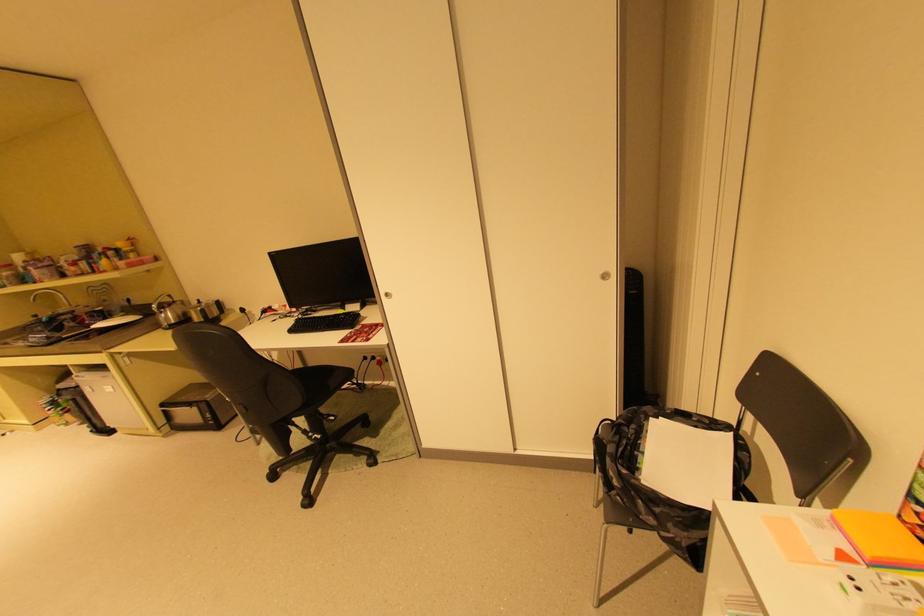
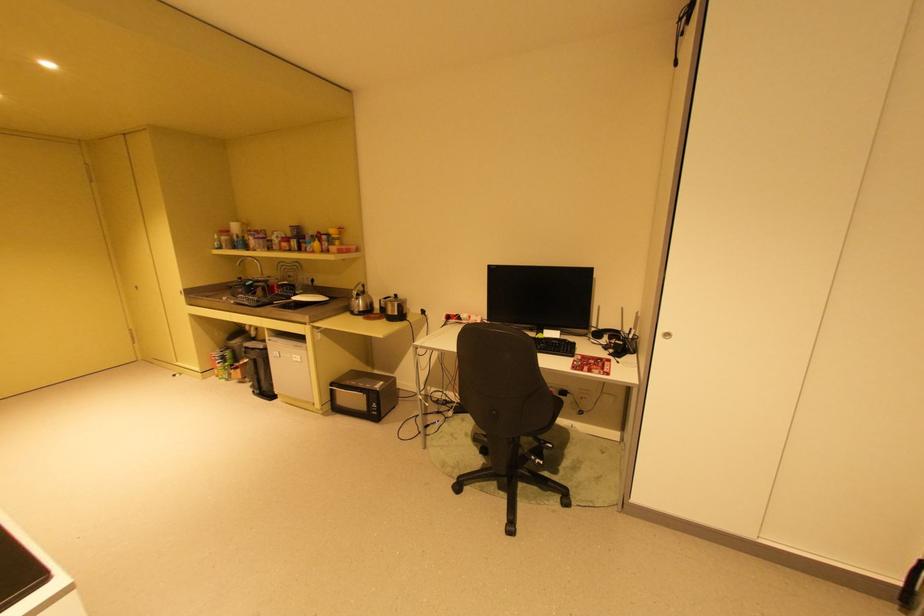
Locate, in the second image, the point that corresponds to pixel 104 326 in the first image.

(304, 299)